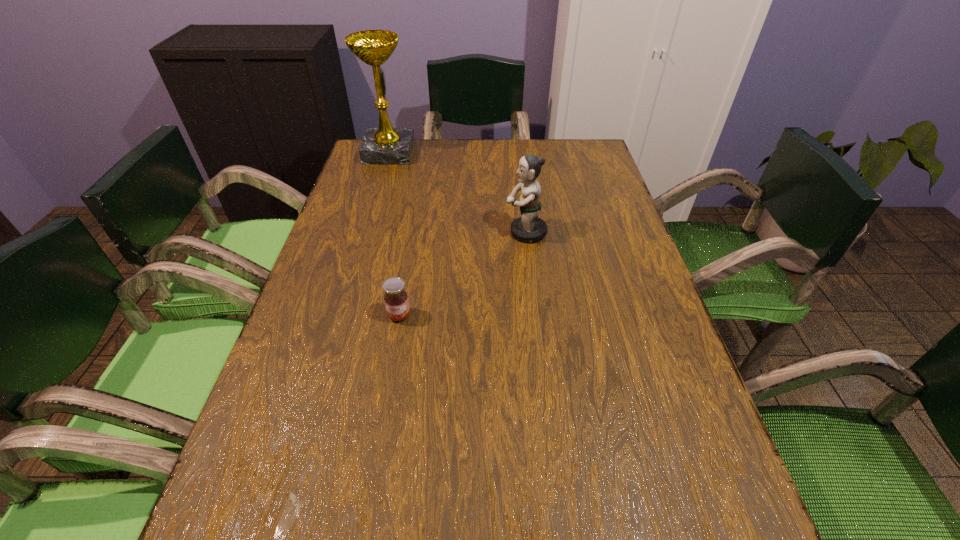
Locate an element on the screen. The width and height of the screenshot is (960, 540). award is located at coordinates (385, 145).

Where is `the leftmost object`? the leftmost object is located at coordinates (385, 145).

What are the coordinates of `the rightmost object` in the screenshot? It's located at (530, 228).

This screenshot has width=960, height=540. I want to click on figurine, so click(x=530, y=228).

Locate an element on the screen. jam is located at coordinates (396, 301).

At what (x,y) coordinates should I click in order to perform the action: click on the nearest object. Please return your answer as a coordinate pair (x, y). Looking at the image, I should click on (396, 301).

Locate an element on the screen. free space located 0.160m on the front-facing side of the farthest object is located at coordinates (462, 153).

I want to click on vacant area situated on the front-facing side of the second shortest object, so click(423, 233).

You are a GUI agent. You are given a task and a screenshot of the screen. Output one action in this format:
    pyautogui.click(x=<x>, y=<y>)
    Task: Click on the vacant space located on the front-facing side of the second shortest object
    The image size is (960, 540).
    Given the screenshot: What is the action you would take?
    pyautogui.click(x=435, y=233)

Image resolution: width=960 pixels, height=540 pixels. I want to click on free point located on the front-facing side of the second shortest object, so click(x=454, y=233).